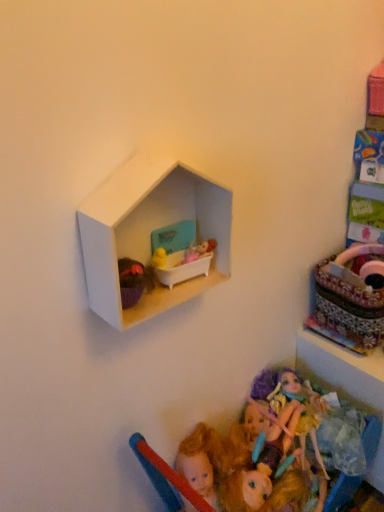
Question: Can you confirm if multicolored plush doll at lower center is positioned to the left of white matte hexagonal shelf at upper center?

Choices:
 (A) yes
 (B) no

Answer: (B)

Question: Considering the relative sizes of multicolored plush doll at lower center and white matte hexagonal shelf at upper center in the image provided, is multicolored plush doll at lower center wider than white matte hexagonal shelf at upper center?

Choices:
 (A) yes
 (B) no

Answer: (A)

Question: Does multicolored plush doll at lower center have a greater height compared to white matte hexagonal shelf at upper center?

Choices:
 (A) no
 (B) yes

Answer: (A)

Question: Considering the relative positions of multicolored plush doll at lower center and white matte hexagonal shelf at upper center in the image provided, is multicolored plush doll at lower center behind white matte hexagonal shelf at upper center?

Choices:
 (A) yes
 (B) no

Answer: (A)

Question: Can you confirm if multicolored plush doll at lower center is thinner than white matte hexagonal shelf at upper center?

Choices:
 (A) no
 (B) yes

Answer: (A)

Question: Is matte plastic bathtub at upper center in front of or behind patterned fabric basket at right in the image?

Choices:
 (A) front
 (B) behind

Answer: (A)

Question: From the image's perspective, is matte plastic bathtub at upper center positioned above or below patterned fabric basket at right?

Choices:
 (A) above
 (B) below

Answer: (A)

Question: Is matte plastic bathtub at upper center taller or shorter than patterned fabric basket at right?

Choices:
 (A) short
 (B) tall

Answer: (A)

Question: Does point (182, 259) appear closer or farther from the camera than point (342, 332)?

Choices:
 (A) closer
 (B) farther

Answer: (A)

Question: Would you say matte plastic bathtub at upper center is to the left or to the right of white matte hexagonal shelf at upper center in the picture?

Choices:
 (A) left
 (B) right

Answer: (B)

Question: From a real-world perspective, is matte plastic bathtub at upper center above or below white matte hexagonal shelf at upper center?

Choices:
 (A) above
 (B) below

Answer: (B)

Question: Considering their positions, is matte plastic bathtub at upper center located in front of or behind white matte hexagonal shelf at upper center?

Choices:
 (A) front
 (B) behind

Answer: (B)

Question: From the image's perspective, is matte plastic bathtub at upper center located above or below white matte hexagonal shelf at upper center?

Choices:
 (A) above
 (B) below

Answer: (B)

Question: Is matte plastic bathtub at upper center bigger or smaller than multicolored plush doll at lower center?

Choices:
 (A) big
 (B) small

Answer: (B)

Question: From a real-world perspective, is matte plastic bathtub at upper center positioned above or below multicolored plush doll at lower center?

Choices:
 (A) below
 (B) above

Answer: (B)